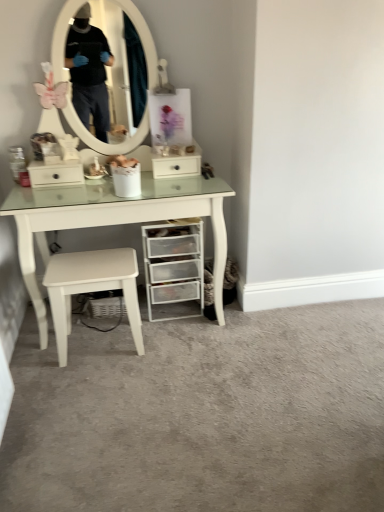
At what (x,y) coordinates should I click in order to perform the action: click on white glossy table at center. Please return your answer as a coordinate pair (x, y). Looking at the image, I should click on (114, 220).

Locate an element on the screen. This screenshot has height=512, width=384. white matte stool at lower center is located at coordinates (91, 288).

This screenshot has width=384, height=512. I want to click on white glossy drawer at center, so (x=176, y=166).

Between white matte stool at lower center and white glossy drawer at center, which one is positioned behind?

white glossy drawer at center is more distant.

From a real-world perspective, which object stands above the other?

From a 3D spatial view, white glossy drawer at center is above.

From the image's perspective, is white matte stool at lower center positioned above or below white glossy drawer at center?

white matte stool at lower center is situated lower than white glossy drawer at center in the image.

How many degrees apart are the facing directions of white matte stool at lower center and clear plastic drawers at lower right?

176 degrees separate the facing orientations of white matte stool at lower center and clear plastic drawers at lower right.

Does point (57, 347) lie in front of point (176, 264)?

Yes, it is in front of point (176, 264).

Between white matte stool at lower center and clear plastic drawers at lower right, which one has less height?

With less height is white matte stool at lower center.

Is white matte stool at lower center aimed at clear plastic drawers at lower right?

No, white matte stool at lower center is not turned towards clear plastic drawers at lower right.

Is clear plastic drawers at lower right to the left or to the right of white glossy table at center in the image?

clear plastic drawers at lower right is positioned on white glossy table at center's right side.

From the image's perspective, between clear plastic drawers at lower right and white glossy table at center, which one is located above?

white glossy table at center, from the image's perspective.

Considering the points (187, 284) and (173, 215), which point is behind, point (187, 284) or point (173, 215)?

Point (187, 284)

From a real-world perspective, is clear plastic drawers at lower right above or below white glossy table at center?

In terms of real-world spatial position, clear plastic drawers at lower right is below white glossy table at center.

Considering the relative sizes of white glossy drawer at center and white matte stool at lower center in the image provided, is white glossy drawer at center taller than white matte stool at lower center?

No, white glossy drawer at center is not taller than white matte stool at lower center.

Considering the relative sizes of white glossy drawer at center and white matte stool at lower center in the image provided, is white glossy drawer at center thinner than white matte stool at lower center?

Yes, white glossy drawer at center is thinner than white matte stool at lower center.

In the image, is white glossy drawer at center positioned in front of or behind white matte stool at lower center?

Clearly, white glossy drawer at center is behind white matte stool at lower center.

Is point (157, 158) positioned in front of point (194, 202)?

No.

In the scene shown: Between white glossy drawer at center and white glossy table at center, which one has more height?

With more height is white glossy table at center.

Would you say white glossy drawer at center is inside or outside white glossy table at center?

white glossy drawer at center is located inside white glossy table at center.

Which of these two, white glossy drawer at center or white glossy table at center, is bigger?

Bigger between the two is white glossy table at center.

Is white glossy table at center looking in the opposite direction of white glossy drawer at center?

Absolutely, white glossy table at center is directed away from white glossy drawer at center.

Which is closer to the camera, (208, 204) or (197, 167)?

The point (208, 204) is in front.

Considering the relative sizes of white glossy table at center and white glossy drawer at center in the image provided, is white glossy table at center smaller than white glossy drawer at center?

No, white glossy table at center is not smaller than white glossy drawer at center.

In the scene shown: Is white glossy table at center taller or shorter than white glossy drawer at center?

In the image, white glossy table at center appears to be taller than white glossy drawer at center.

Who is shorter, clear plastic drawers at lower right or white matte stool at lower center?

white matte stool at lower center.

Is white matte stool at lower center completely or partially inside clear plastic drawers at lower right?

No, white matte stool at lower center is not surrounded by clear plastic drawers at lower right.

Could you tell me if clear plastic drawers at lower right is turned towards white matte stool at lower center?

No, clear plastic drawers at lower right is not oriented towards white matte stool at lower center.

From the picture: Is clear plastic drawers at lower right at the left side of white matte stool at lower center?

No, clear plastic drawers at lower right is not to the left of white matte stool at lower center.

This screenshot has height=512, width=384. What are the coordinates of `stool below the white glossy drawer at center (from the image's perspective)` in the screenshot? It's located at (91, 288).

The image size is (384, 512). I want to click on stool lying in front of the clear plastic drawers at lower right, so click(91, 288).

Which object lies nearer to the anchor point clear plastic drawers at lower right, white glossy drawer at center or white matte stool at lower center?

Among the two, white matte stool at lower center is located nearer to clear plastic drawers at lower right.

Based on their spatial positions, is white matte stool at lower center or clear plastic drawers at lower right closer to white glossy table at center?

Among the two, white matte stool at lower center is located nearer to white glossy table at center.

Consider the image. When comparing their distances from white glossy drawer at center, does white glossy table at center or white matte stool at lower center seem closer?

white glossy table at center is closer to white glossy drawer at center.

Looking at the image, which one is located closer to white matte stool at lower center, white glossy drawer at center or white glossy table at center?

white glossy table at center.

Looking at the image, which one is located further to clear plastic drawers at lower right, white glossy table at center or white glossy drawer at center?

The object further to clear plastic drawers at lower right is white glossy drawer at center.

From the picture: When comparing their distances from white glossy table at center, does clear plastic drawers at lower right or white matte stool at lower center seem closer?

Based on the image, white matte stool at lower center appears to be nearer to white glossy table at center.

Based on the photo, when comparing their distances from white matte stool at lower center, does clear plastic drawers at lower right or white glossy table at center seem further?

clear plastic drawers at lower right is positioned further to the anchor white matte stool at lower center.

Estimate the real-world distances between objects in this image. Which object is further from clear plastic drawers at lower right, white matte stool at lower center or white glossy drawer at center?

white glossy drawer at center.

Where is `stool located between white glossy table at center and clear plastic drawers at lower right in the depth direction`? stool located between white glossy table at center and clear plastic drawers at lower right in the depth direction is located at coordinates (91, 288).

Locate an element on the screen. The width and height of the screenshot is (384, 512). table between white glossy drawer at center and white matte stool at lower center vertically is located at coordinates (114, 220).

In order to click on the chest of drawers located between white glossy table at center and white glossy drawer at center in the depth direction in this screenshot , I will do `click(174, 269)`.

Image resolution: width=384 pixels, height=512 pixels. What are the coordinates of `chest of drawers between white glossy drawer at center and white matte stool at lower center in the up-down direction` in the screenshot? It's located at (174, 269).